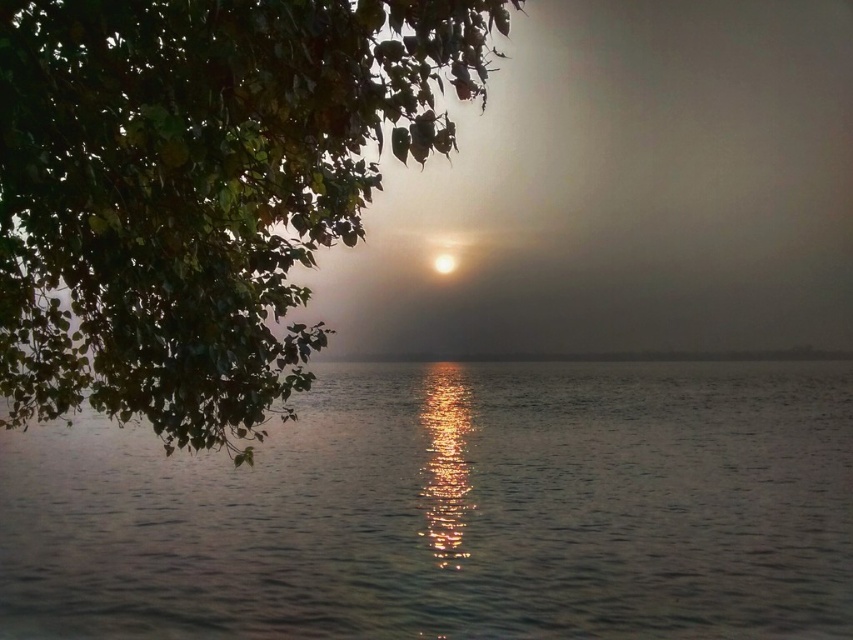
Question: Can you confirm if green leafy tree at upper left is positioned to the left of bright white orb at center?

Choices:
 (A) yes
 (B) no

Answer: (A)

Question: Which object is farther from the camera taking this photo?

Choices:
 (A) green leafy tree at upper left
 (B) bright white orb at center

Answer: (B)

Question: Which of the following is the farthest from the observer?

Choices:
 (A) green leafy tree at upper left
 (B) glistening silver water at center
 (C) bright white orb at center

Answer: (C)

Question: Can you confirm if glistening silver water at center is thinner than green leafy tree at upper left?

Choices:
 (A) yes
 (B) no

Answer: (B)

Question: Can you confirm if green leafy tree at upper left is thinner than bright white orb at center?

Choices:
 (A) no
 (B) yes

Answer: (A)

Question: Considering the real-world distances, which object is farthest from the glistening silver water at center?

Choices:
 (A) green leafy tree at upper left
 (B) bright white orb at center

Answer: (A)